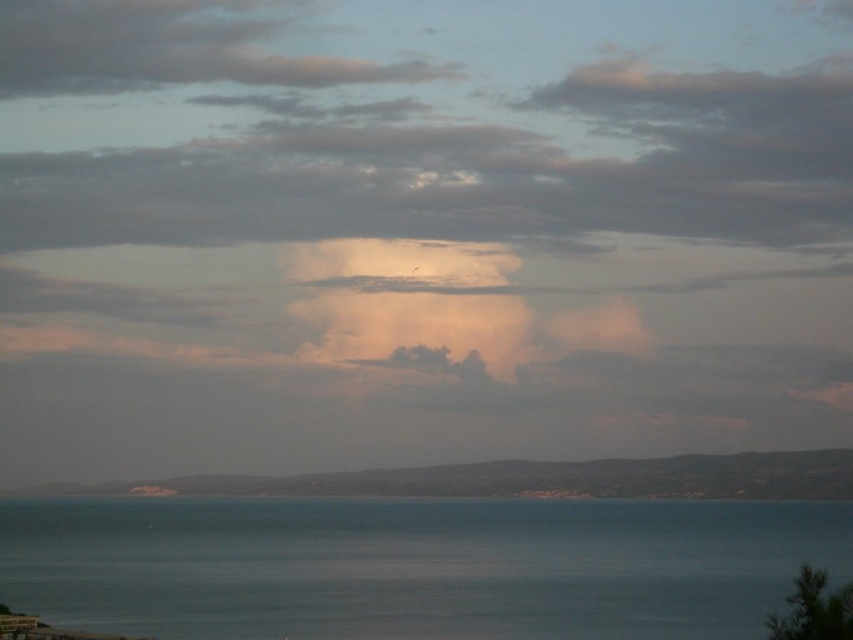
Question: Observing the image, what is the correct spatial positioning of blue water at center in reference to smooth sand at lower center?

Choices:
 (A) left
 (B) right

Answer: (A)

Question: Does blue water at center have a smaller size compared to smooth sand at lower center?

Choices:
 (A) no
 (B) yes

Answer: (A)

Question: Which point appears farthest from the camera in this image?

Choices:
 (A) (476, 490)
 (B) (633, 595)

Answer: (A)

Question: Considering the relative positions of blue water at center and smooth sand at lower center in the image provided, where is blue water at center located with respect to smooth sand at lower center?

Choices:
 (A) above
 (B) below

Answer: (A)